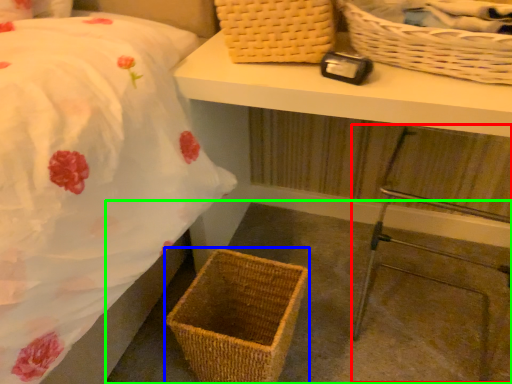
Question: Considering the real-world distances, which object is closest to step stool (highlighted by a red box)? picnic basket (highlighted by a blue box) or concrete (highlighted by a green box).

Choices:
 (A) picnic basket
 (B) concrete

Answer: (B)